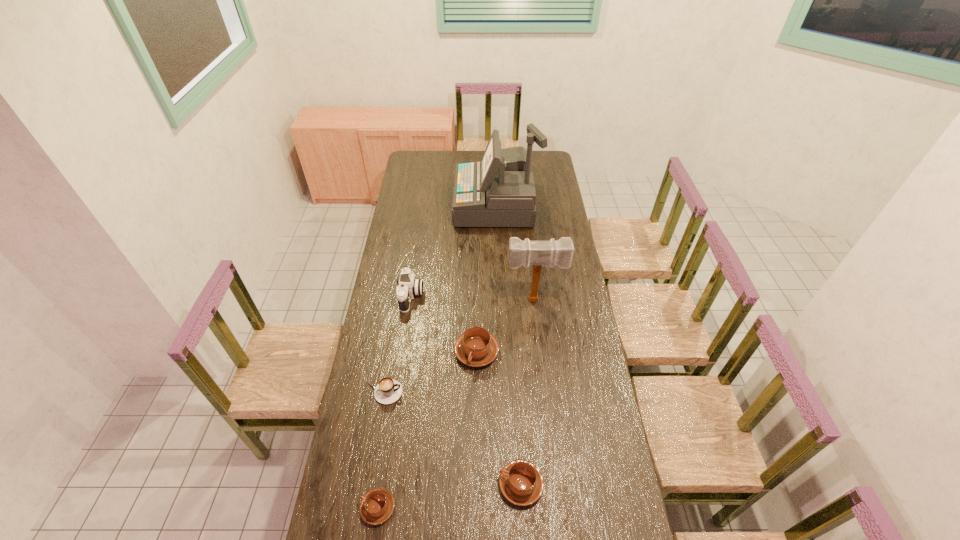
Locate an element on the screen. the farthest object is located at coordinates (499, 191).

Locate an element on the screen. cash register is located at coordinates (499, 191).

Find the location of a particular element. The width and height of the screenshot is (960, 540). mallet is located at coordinates (537, 253).

Locate an element on the screen. This screenshot has width=960, height=540. wood mallet is located at coordinates (537, 253).

Where is `camera`? The width and height of the screenshot is (960, 540). camera is located at coordinates (408, 286).

Find the location of `the third tallest object`. the third tallest object is located at coordinates (408, 286).

In order to click on the farthest cappuccino in this screenshot , I will do `click(476, 347)`.

What are the coordinates of `the fourth tallest object` in the screenshot? It's located at (476, 347).

Locate an element on the screen. the third shortest object is located at coordinates (521, 482).

You are a GUI agent. You are given a task and a screenshot of the screen. Output one action in this format:
    pyautogui.click(x=<x>, y=<y>)
    Task: Click on the second tallest cappuccino
    The height and width of the screenshot is (540, 960).
    Given the screenshot: What is the action you would take?
    pyautogui.click(x=521, y=482)